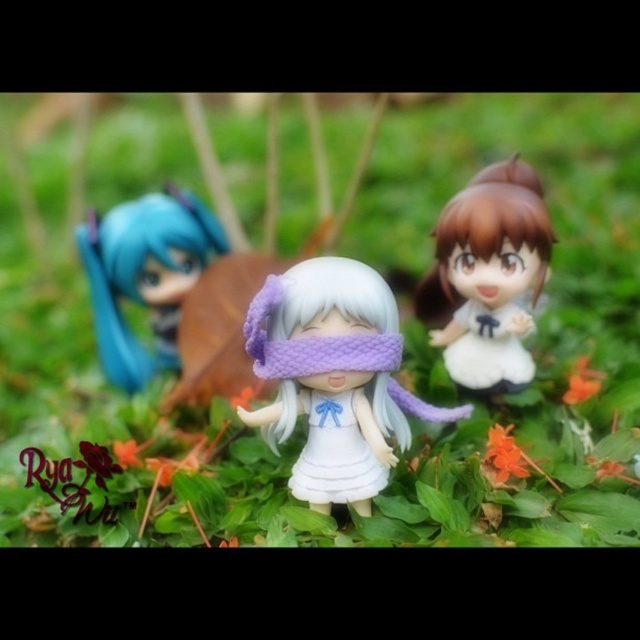
Who is positioned more to the right, green grass at center or white matte dress at center?

Positioned to the right is white matte dress at center.

Between green grass at center and white matte dress at center, which one has less height?

Standing shorter between the two is white matte dress at center.

The width and height of the screenshot is (640, 640). In order to click on green grass at center in this screenshot , I will do `click(412, 420)`.

Who is positioned more to the left, matte white figurine at center or white matte dress at center?

From the viewer's perspective, white matte dress at center appears more on the left side.

Looking at this image, does matte white figurine at center lie behind white matte dress at center?

That is True.

You are a GUI agent. You are given a task and a screenshot of the screen. Output one action in this format:
    pyautogui.click(x=<x>, y=<y>)
    Task: Click on the matte white figurine at center
    This screenshot has height=640, width=640.
    Given the screenshot: What is the action you would take?
    point(488,275)

Who is positioned more to the left, green grass at center or matte blue hair at left?

matte blue hair at left

Between green grass at center and matte blue hair at left, which one is positioned lower?

matte blue hair at left is lower down.

Locate an element on the screen. green grass at center is located at coordinates (412, 420).

This screenshot has height=640, width=640. I want to click on green grass at center, so 412,420.